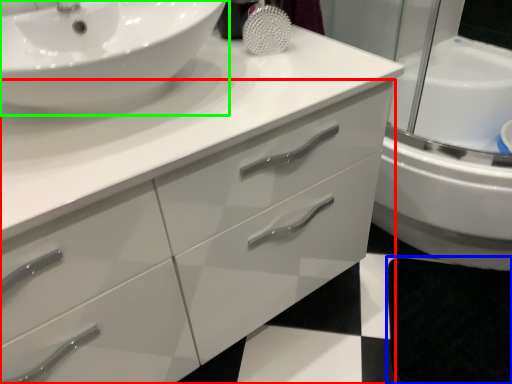
Question: Estimate the real-world distances between objects in this image. Which object is closer to bathroom cabinet (highlighted by a red box), bath mat (highlighted by a blue box) or sink (highlighted by a green box)?

Choices:
 (A) bath mat
 (B) sink

Answer: (B)